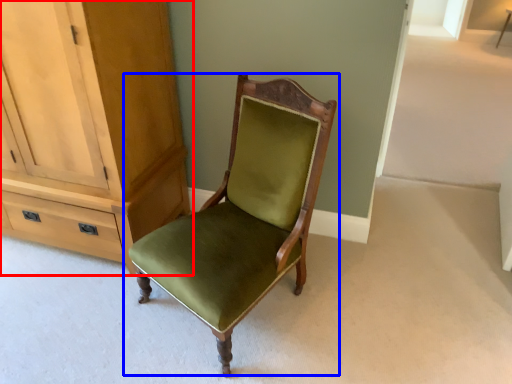
Question: Which of the following is the farthest to the observer, cabinetry (highlighted by a red box) or chair (highlighted by a blue box)?

Choices:
 (A) cabinetry
 (B) chair

Answer: (A)